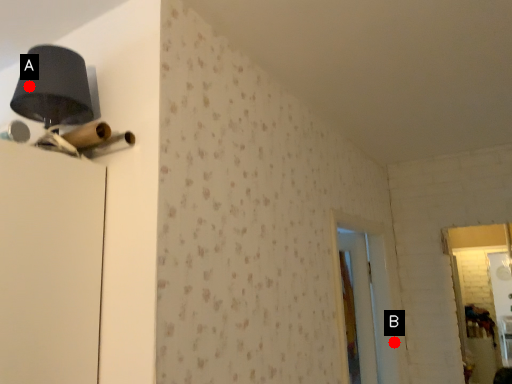
Question: Two points are circled on the image, labeled by A and B beside each circle. Which point appears closest to the camera in this image?

Choices:
 (A) A is closer
 (B) B is closer

Answer: (A)